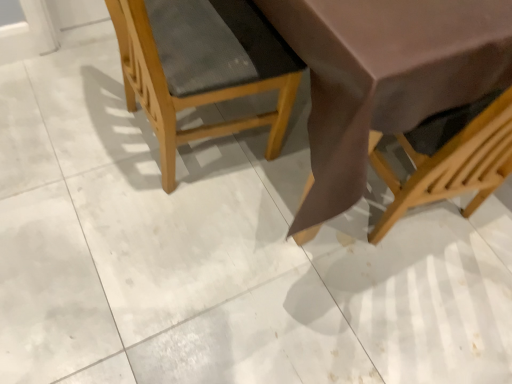
What is the approximate width of wooden textured chair at center, the second chair when ordered from right to left?

It is 19.70 inches.

Find the location of a particular element. wooden textured chair at center, the second chair when ordered from right to left is located at coordinates (202, 66).

Measure the distance between wooden textured chair at center, the second chair when ordered from right to left, and camera.

wooden textured chair at center, the second chair when ordered from right to left, is 87.48 centimeters from camera.

This screenshot has height=384, width=512. Describe the element at coordinates (202, 66) in the screenshot. I see `wooden textured chair at center, the second chair when ordered from right to left` at that location.

This screenshot has width=512, height=384. I want to click on matte brown chair at right, which is the 2th chair from left to right, so click(x=450, y=165).

In order to face matte brown chair at right, the first chair viewed from the right, should I rotate leftwards or rightwards?

Turn right by 25.444 degrees to look at matte brown chair at right, the first chair viewed from the right.

Image resolution: width=512 pixels, height=384 pixels. What do you see at coordinates (450, 165) in the screenshot?
I see `matte brown chair at right, which is the 2th chair from left to right` at bounding box center [450, 165].

Where is `wooden textured chair at center, the second chair when ordered from right to left`? The height and width of the screenshot is (384, 512). wooden textured chair at center, the second chair when ordered from right to left is located at coordinates (202, 66).

Can you confirm if matte brown chair at right, which is the 2th chair from left to right, is positioned to the right of wooden textured chair at center, the first chair from the left?

Yes, matte brown chair at right, which is the 2th chair from left to right, is to the right of wooden textured chair at center, the first chair from the left.

Considering the relative positions of matte brown chair at right, which is the 2th chair from left to right, and wooden textured chair at center, the second chair when ordered from right to left, in the image provided, is matte brown chair at right, which is the 2th chair from left to right, in front of wooden textured chair at center, the second chair when ordered from right to left,?

Yes, the depth of matte brown chair at right, which is the 2th chair from left to right, is less than that of wooden textured chair at center, the second chair when ordered from right to left.

Does point (475, 206) come in front of point (234, 74)?

That is False.

From the image's perspective, which is below, matte brown chair at right, which is the 2th chair from left to right, or wooden textured chair at center, the first chair from the left?

matte brown chair at right, which is the 2th chair from left to right, appears lower in the image.

Based on the photo, from a real-world perspective, is matte brown chair at right, which is the 2th chair from left to right, located beneath wooden textured chair at center, the first chair from the left?

Actually, matte brown chair at right, which is the 2th chair from left to right, is physically above wooden textured chair at center, the first chair from the left, in the real world.

Looking at this image, which object is thinner, matte brown chair at right, the first chair viewed from the right, or wooden textured chair at center, the first chair from the left?

wooden textured chair at center, the first chair from the left.

Can you confirm if matte brown chair at right, which is the 2th chair from left to right, is shorter than wooden textured chair at center, the second chair when ordered from right to left?

In fact, matte brown chair at right, which is the 2th chair from left to right, may be taller than wooden textured chair at center, the second chair when ordered from right to left.

Looking at the image, does matte brown chair at right, which is the 2th chair from left to right, seem bigger or smaller compared to wooden textured chair at center, the second chair when ordered from right to left?

Considering their sizes, matte brown chair at right, which is the 2th chair from left to right, takes up more space than wooden textured chair at center, the second chair when ordered from right to left.

In the scene shown: Can we say matte brown chair at right, which is the 2th chair from left to right, lies outside wooden textured chair at center, the first chair from the left?

Yes, matte brown chair at right, which is the 2th chair from left to right, is located beyond the bounds of wooden textured chair at center, the first chair from the left.

Are matte brown chair at right, which is the 2th chair from left to right, and wooden textured chair at center, the second chair when ordered from right to left, located far from each other?

That's not correct — matte brown chair at right, which is the 2th chair from left to right, is a little close to wooden textured chair at center, the second chair when ordered from right to left.

Is matte brown chair at right, the first chair viewed from the right, oriented away from wooden textured chair at center, the second chair when ordered from right to left?

matte brown chair at right, the first chair viewed from the right, is not turned away from wooden textured chair at center, the second chair when ordered from right to left.

How far apart are matte brown chair at right, the first chair viewed from the right, and wooden textured chair at center, the first chair from the left?

51.24 centimeters.

You are a GUI agent. You are given a task and a screenshot of the screen. Output one action in this format:
    pyautogui.click(x=<x>, y=<y>)
    Task: Click on the chair that is above the wooden textured chair at center, the first chair from the left (from a real-world perspective)
    This screenshot has width=512, height=384.
    Given the screenshot: What is the action you would take?
    pyautogui.click(x=450, y=165)

Is wooden textured chair at center, the first chair from the left, to the left of matte brown chair at right, which is the 2th chair from left to right, from the viewer's perspective?

Indeed, wooden textured chair at center, the first chair from the left, is positioned on the left side of matte brown chair at right, which is the 2th chair from left to right.

Considering the relative positions of wooden textured chair at center, the second chair when ordered from right to left, and matte brown chair at right, the first chair viewed from the right, in the image provided, is wooden textured chair at center, the second chair when ordered from right to left, behind matte brown chair at right, the first chair viewed from the right,?

Yes, wooden textured chair at center, the second chair when ordered from right to left, is behind matte brown chair at right, the first chair viewed from the right.

Which point is more distant from viewer, [163,68] or [431,189]?

The point [431,189] is farther.

From the image's perspective, which is below, wooden textured chair at center, the second chair when ordered from right to left, or matte brown chair at right, which is the 2th chair from left to right?

matte brown chair at right, which is the 2th chair from left to right, from the image's perspective.

Looking at this image, from a real-world perspective, is wooden textured chair at center, the first chair from the left, located beneath matte brown chair at right, the first chair viewed from the right?

Yes, from a real-world perspective, wooden textured chair at center, the first chair from the left, is beneath matte brown chair at right, the first chair viewed from the right.

Between wooden textured chair at center, the first chair from the left, and matte brown chair at right, which is the 2th chair from left to right, which one has larger width?

Wider between the two is matte brown chair at right, which is the 2th chair from left to right.

Considering the sizes of objects wooden textured chair at center, the second chair when ordered from right to left, and matte brown chair at right, which is the 2th chair from left to right, in the image provided, who is taller, wooden textured chair at center, the second chair when ordered from right to left, or matte brown chair at right, which is the 2th chair from left to right,?

matte brown chair at right, which is the 2th chair from left to right, is taller.

Who is smaller, wooden textured chair at center, the first chair from the left, or matte brown chair at right, the first chair viewed from the right?

Smaller between the two is wooden textured chair at center, the first chair from the left.

Is wooden textured chair at center, the first chair from the left, inside the boundaries of matte brown chair at right, the first chair viewed from the right, or outside?

wooden textured chair at center, the first chair from the left, is spatially situated outside matte brown chair at right, the first chair viewed from the right.

Is wooden textured chair at center, the second chair when ordered from right to left, placed right next to matte brown chair at right, the first chair viewed from the right?

No.

Could you tell me if wooden textured chair at center, the first chair from the left, is facing matte brown chair at right, which is the 2th chair from left to right?

No, wooden textured chair at center, the first chair from the left, does not turn towards matte brown chair at right, which is the 2th chair from left to right.

How far apart are wooden textured chair at center, the first chair from the left, and matte brown chair at right, which is the 2th chair from left to right?

wooden textured chair at center, the first chair from the left, is 20.17 inches away from matte brown chair at right, which is the 2th chair from left to right.

At what (x,y) coordinates should I click in order to perform the action: click on chair on the left of matte brown chair at right, which is the 2th chair from left to right. Please return your answer as a coordinate pair (x, y). The image size is (512, 384). Looking at the image, I should click on (202, 66).

This screenshot has width=512, height=384. What are the coordinates of `chair above the wooden textured chair at center, the first chair from the left (from a real-world perspective)` in the screenshot? It's located at 450,165.

At what (x,y) coordinates should I click in order to perform the action: click on chair in front of the wooden textured chair at center, the first chair from the left. Please return your answer as a coordinate pair (x, y). Looking at the image, I should click on (450, 165).